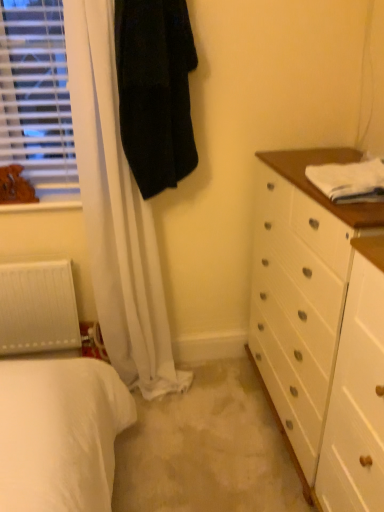
Question: Is the position of black fuzzy coat at upper left more distant than that of white matte radiator at lower left?

Choices:
 (A) yes
 (B) no

Answer: (B)

Question: Does black fuzzy coat at upper left turn towards white matte radiator at lower left?

Choices:
 (A) yes
 (B) no

Answer: (B)

Question: From a real-world perspective, is black fuzzy coat at upper left positioned under white matte radiator at lower left based on gravity?

Choices:
 (A) yes
 (B) no

Answer: (B)

Question: Is black fuzzy coat at upper left at the right side of white matte radiator at lower left?

Choices:
 (A) no
 (B) yes

Answer: (B)

Question: Is black fuzzy coat at upper left smaller than white matte radiator at lower left?

Choices:
 (A) no
 (B) yes

Answer: (A)

Question: Is white matte radiator at lower left wider or thinner than white cotton towel at upper right?

Choices:
 (A) wide
 (B) thin

Answer: (B)

Question: Considering their positions, is white matte radiator at lower left located in front of or behind white cotton towel at upper right?

Choices:
 (A) front
 (B) behind

Answer: (B)

Question: From the image's perspective, is white matte radiator at lower left located above or below white cotton towel at upper right?

Choices:
 (A) above
 (B) below

Answer: (B)

Question: Considering the positions of white matte radiator at lower left and white cotton towel at upper right in the image, is white matte radiator at lower left taller or shorter than white cotton towel at upper right?

Choices:
 (A) short
 (B) tall

Answer: (B)

Question: From the image's perspective, is black fuzzy coat at upper left above or below wooden frame at left?

Choices:
 (A) below
 (B) above

Answer: (B)

Question: Considering the positions of black fuzzy coat at upper left and wooden frame at left in the image, is black fuzzy coat at upper left wider or thinner than wooden frame at left?

Choices:
 (A) wide
 (B) thin

Answer: (B)

Question: From a real-world perspective, is black fuzzy coat at upper left positioned above or below wooden frame at left?

Choices:
 (A) above
 (B) below

Answer: (A)

Question: From their relative heights in the image, would you say black fuzzy coat at upper left is taller or shorter than wooden frame at left?

Choices:
 (A) short
 (B) tall

Answer: (B)

Question: Visually, is white cotton towel at upper right positioned to the left or to the right of brown leather dog at left?

Choices:
 (A) right
 (B) left

Answer: (A)

Question: Is white cotton towel at upper right in front of or behind brown leather dog at left in the image?

Choices:
 (A) front
 (B) behind

Answer: (A)